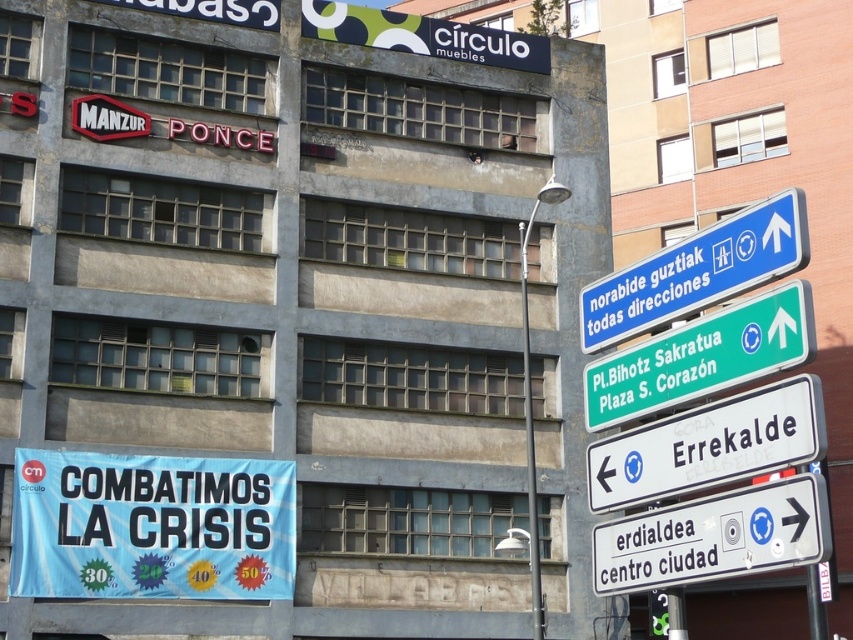
What do you see at coordinates (701, 356) in the screenshot?
I see `blue plastic sign at upper center` at bounding box center [701, 356].

Locate an element on the screen. This screenshot has width=853, height=640. blue plastic sign at upper center is located at coordinates point(701,356).

The image size is (853, 640). In order to click on blue plastic sign at upper center in this screenshot , I will do `click(701, 356)`.

Can you confirm if light blue fabric banner at lower left is shorter than metallic pole at center?

Correct, light blue fabric banner at lower left is not as tall as metallic pole at center.

Between light blue fabric banner at lower left and metallic pole at center, which one appears on the left side from the viewer's perspective?

Positioned to the left is light blue fabric banner at lower left.

Is point (273, 572) farther from camera compared to point (531, 529)?

Yes, it is.

You are a GUI agent. You are given a task and a screenshot of the screen. Output one action in this format:
    pyautogui.click(x=<x>, y=<y>)
    Task: Click on the light blue fabric banner at lower left
    The height and width of the screenshot is (640, 853).
    Given the screenshot: What is the action you would take?
    pyautogui.click(x=151, y=525)

Does light blue fabric banner at lower left have a greater height compared to blue plastic sign at upper center?

Indeed, light blue fabric banner at lower left has a greater height compared to blue plastic sign at upper center.

Which is below, light blue fabric banner at lower left or blue plastic sign at upper center?

Positioned lower is light blue fabric banner at lower left.

Image resolution: width=853 pixels, height=640 pixels. I want to click on light blue fabric banner at lower left, so click(x=151, y=525).